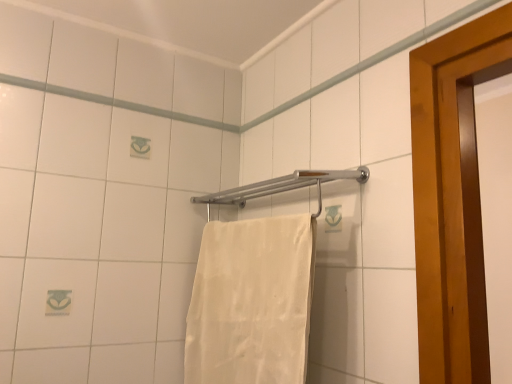
Question: Is silver metallic towel bar at center inside white cotton towel at center?

Choices:
 (A) no
 (B) yes

Answer: (A)

Question: Can you confirm if white cotton towel at center is smaller than silver metallic towel bar at center?

Choices:
 (A) yes
 (B) no

Answer: (B)

Question: Does white cotton towel at center have a greater height compared to silver metallic towel bar at center?

Choices:
 (A) yes
 (B) no

Answer: (A)

Question: Would you consider white cotton towel at center to be distant from silver metallic towel bar at center?

Choices:
 (A) no
 (B) yes

Answer: (A)

Question: Is white cotton towel at center facing away from silver metallic towel bar at center?

Choices:
 (A) no
 (B) yes

Answer: (A)

Question: Does white cotton towel at center have a greater width compared to silver metallic towel bar at center?

Choices:
 (A) yes
 (B) no

Answer: (B)

Question: From the image's perspective, is silver metallic towel bar at center below white cotton towel at center?

Choices:
 (A) no
 (B) yes

Answer: (A)

Question: Is silver metallic towel bar at center at the right side of white cotton towel at center?

Choices:
 (A) no
 (B) yes

Answer: (B)

Question: Does silver metallic towel bar at center have a smaller size compared to white cotton towel at center?

Choices:
 (A) no
 (B) yes

Answer: (B)

Question: Does silver metallic towel bar at center come behind white cotton towel at center?

Choices:
 (A) yes
 (B) no

Answer: (A)

Question: Can you confirm if silver metallic towel bar at center is taller than white cotton towel at center?

Choices:
 (A) yes
 (B) no

Answer: (B)

Question: Is silver metallic towel bar at center thinner than white cotton towel at center?

Choices:
 (A) no
 (B) yes

Answer: (A)

Question: Considering the positions of point (266, 269) and point (280, 183), is point (266, 269) closer or farther from the camera than point (280, 183)?

Choices:
 (A) closer
 (B) farther

Answer: (A)